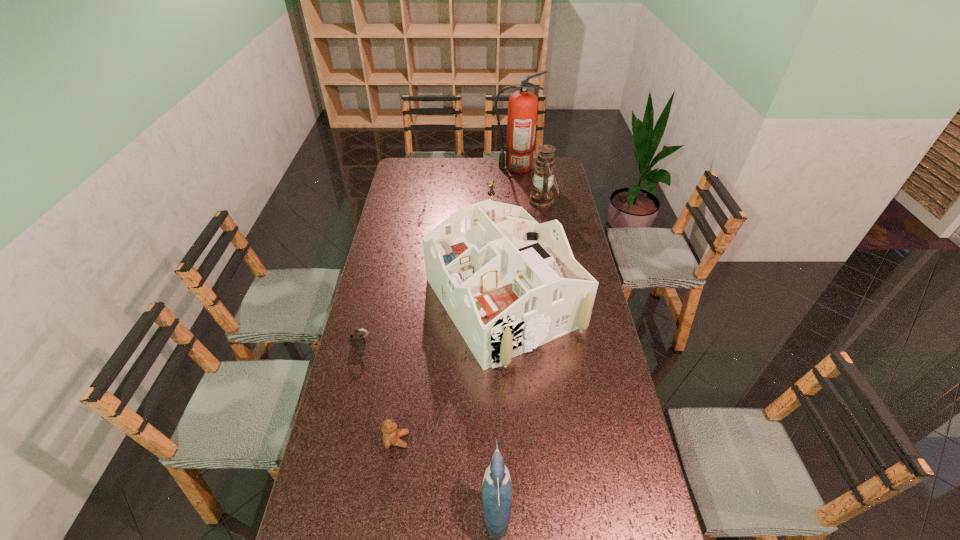
Where is `object that is positioned at the left edge`? The height and width of the screenshot is (540, 960). object that is positioned at the left edge is located at coordinates (357, 340).

Where is `fire extinguisher that is at the right edge`? fire extinguisher that is at the right edge is located at coordinates pyautogui.click(x=522, y=106).

Locate an element on the screen. dollhouse positioned at the right edge is located at coordinates (509, 284).

The image size is (960, 540). What are the coordinates of `lantern that is at the right edge` in the screenshot? It's located at (541, 197).

The image size is (960, 540). What are the coordinates of `object positioned at the far right corner` in the screenshot? It's located at (522, 106).

Where is `vacant space at the far edge`? The width and height of the screenshot is (960, 540). vacant space at the far edge is located at coordinates (468, 169).

In the image, there is a desktop. At what (x,y) coordinates should I click in order to perform the action: click on free region at the left edge. Please return your answer as a coordinate pair (x, y). Looking at the image, I should click on (406, 278).

In the image, there is a desktop. Where is `vacant space at the right edge`? vacant space at the right edge is located at coordinates (584, 461).

The image size is (960, 540). I want to click on free spot between the sixth tallest object and the leftmost object, so click(x=379, y=393).

What are the coordinates of `vacant region between the dollhouse and the shortest object` in the screenshot? It's located at (433, 323).